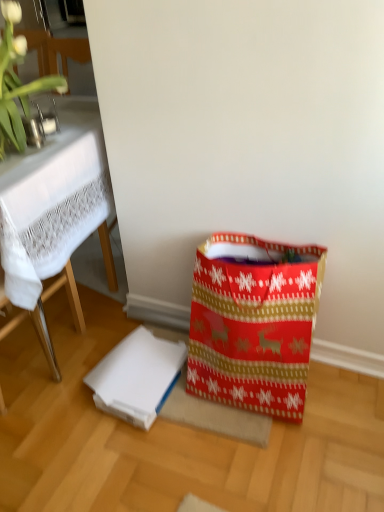
At what (x,y) coordinates should I click in order to perform the action: click on free space in front of red paper shopping bag at lower right. Please return your answer as a coordinate pair (x, y). The width and height of the screenshot is (384, 512). Looking at the image, I should click on (259, 463).